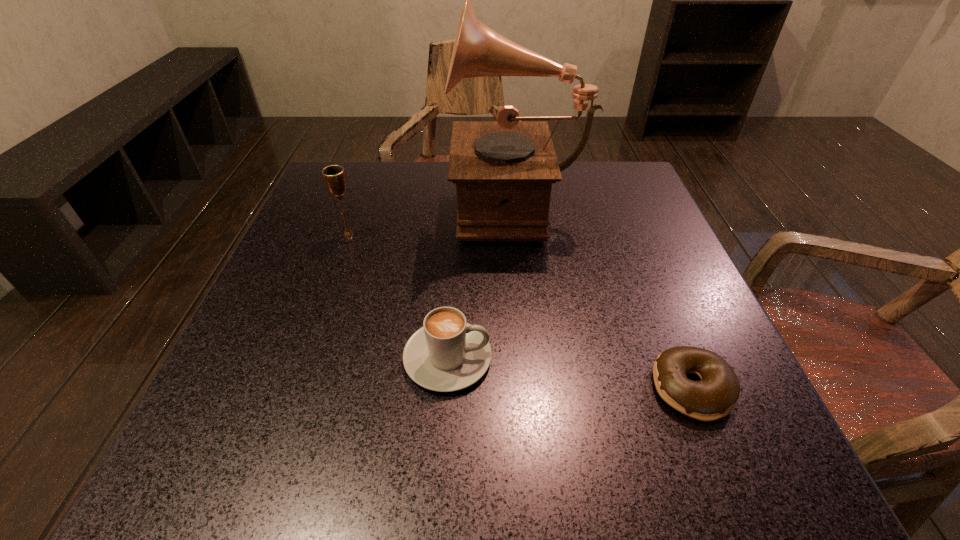
You are a GUI agent. You are given a task and a screenshot of the screen. Output one action in this format:
    pyautogui.click(x=<x>, y=<y>)
    Task: Click on the blank space at the right edge
    
    Given the screenshot: What is the action you would take?
    pyautogui.click(x=685, y=278)

In the image, there is a desktop. Identify the location of free space at the far left corner. (334, 208).

This screenshot has height=540, width=960. I want to click on free space at the far right corner, so click(637, 183).

Where is `free area in between the chalice and the cappuccino`? The height and width of the screenshot is (540, 960). free area in between the chalice and the cappuccino is located at coordinates (398, 296).

You are a GUI agent. You are given a task and a screenshot of the screen. Output one action in this format:
    pyautogui.click(x=<x>, y=<y>)
    Task: Click on the blank region between the leftmost object and the rightmost object
    The width and height of the screenshot is (960, 540).
    Given the screenshot: What is the action you would take?
    pyautogui.click(x=520, y=311)

You are a GUI agent. You are given a task and a screenshot of the screen. Output one action in this format:
    pyautogui.click(x=<x>, y=<y>)
    Task: Click on the empty location between the record player and the cappuccino
    
    Given the screenshot: What is the action you would take?
    pyautogui.click(x=482, y=280)

Find the location of a particular element. This screenshot has height=540, width=960. unoccupied position between the rightmost object and the cappuccino is located at coordinates [570, 373].

What are the coordinates of `empty location between the second tallest object and the rightmost object` in the screenshot? It's located at (520, 311).

What are the coordinates of `free space that is in between the shortest object and the second shortest object` in the screenshot? It's located at (570, 373).

This screenshot has width=960, height=540. Identify the location of blank region between the second tallest object and the record player. (432, 218).